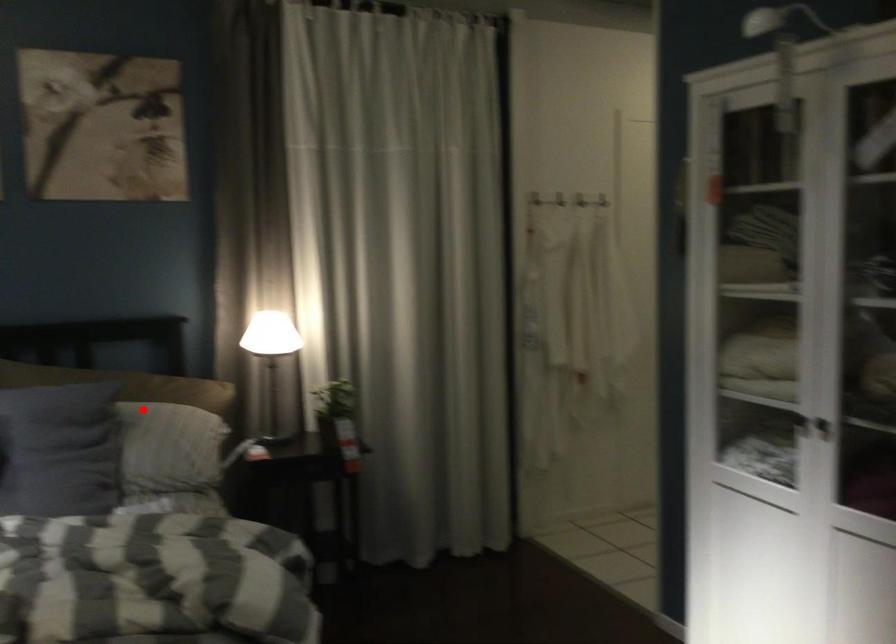
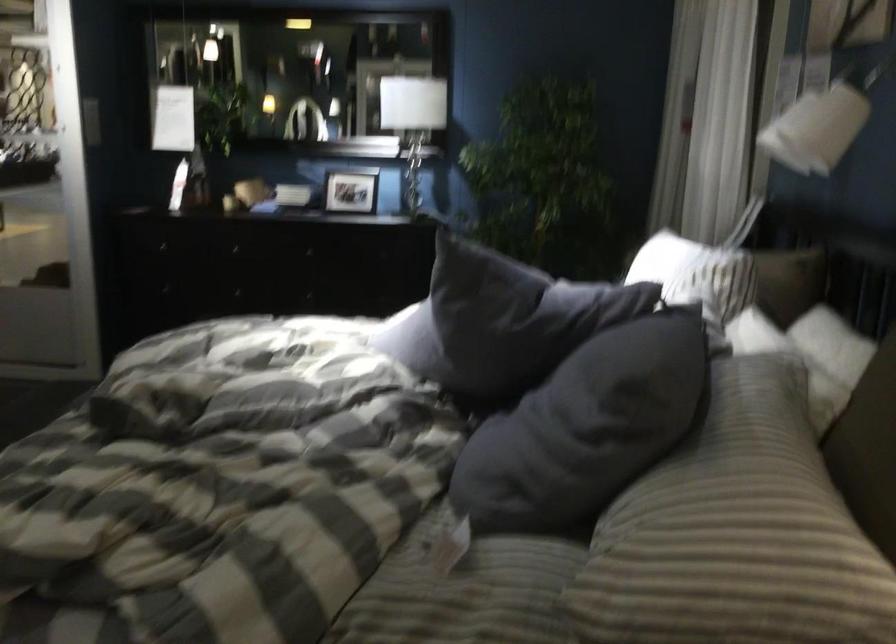
Question: A red point is marked in image1. In image2, is the corresponding 3D point closer to the camera or farther? Reply with the corresponding letter.

Choices:
 (A) The corresponding 3D point is closer.
 (B) The corresponding 3D point is farther.

Answer: (A)